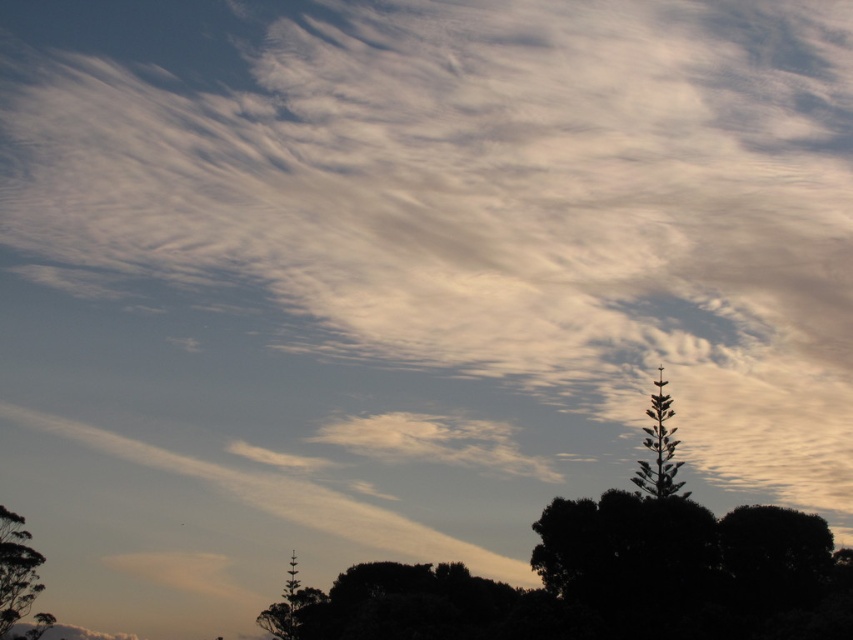
Who is shorter, green leafy tree at lower left or green leafy tree at upper right?

Standing shorter between the two is green leafy tree at upper right.

Who is more forward, [28,593] or [660,403]?

Positioned in front is point [28,593].

Image resolution: width=853 pixels, height=640 pixels. Identify the location of green leafy tree at lower left. 15,570.

Is point (33, 564) closer to viewer compared to point (308, 596)?

Yes, point (33, 564) is closer to viewer.

Does point (4, 612) come behind point (264, 618)?

No, it is not.

Is point (22, 545) closer to viewer compared to point (320, 595)?

Yes, point (22, 545) is closer to viewer.

You are a GUI agent. You are given a task and a screenshot of the screen. Output one action in this format:
    pyautogui.click(x=<x>, y=<y>)
    Task: Click on the green leafy tree at lower left
    This screenshot has height=640, width=853.
    Given the screenshot: What is the action you would take?
    pyautogui.click(x=15, y=570)

Between green leafy tree at upper right and green leafy tree at center, which one is positioned lower?

green leafy tree at center

Describe the element at coordinates (659, 451) in the screenshot. I see `green leafy tree at upper right` at that location.

This screenshot has height=640, width=853. In order to click on green leafy tree at upper right in this screenshot , I will do `click(659, 451)`.